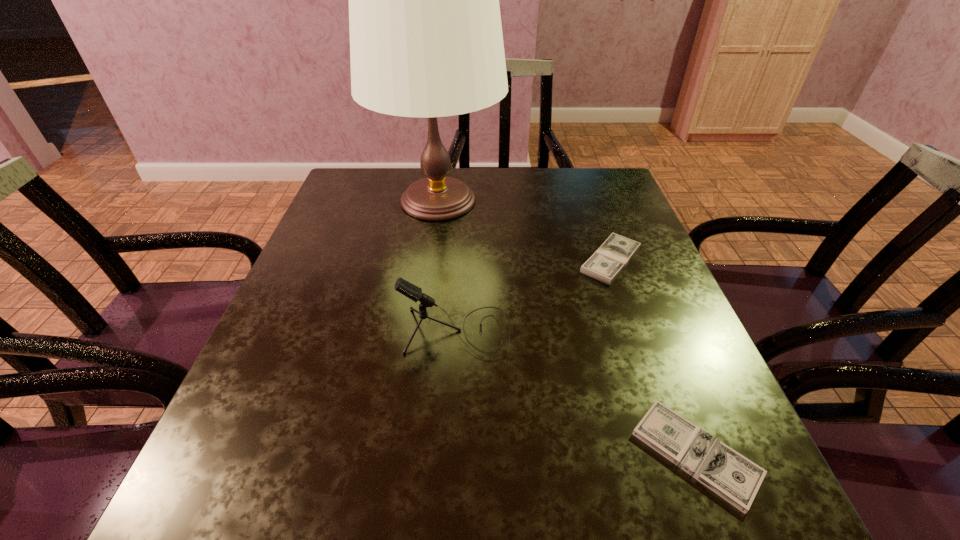
Identify the location of vacant region at the far left corner of the desktop. This screenshot has width=960, height=540. (334, 199).

Image resolution: width=960 pixels, height=540 pixels. What are the coordinates of `free location at the near left corner of the desktop` in the screenshot? It's located at (194, 484).

Find the location of a particular element. Image resolution: width=960 pixels, height=540 pixels. free space at the far right corner of the desktop is located at coordinates (584, 208).

In the image, there is a desktop. At what (x,y) coordinates should I click in order to perform the action: click on vacant space at the near right corner. Please return your answer as a coordinate pair (x, y). The width and height of the screenshot is (960, 540). Looking at the image, I should click on (718, 506).

You are a GUI agent. You are given a task and a screenshot of the screen. Output one action in this format:
    pyautogui.click(x=<x>, y=<y>)
    Task: Click on the free space between the lamp and the microphone
    The height and width of the screenshot is (540, 960).
    Given the screenshot: What is the action you would take?
    pyautogui.click(x=447, y=267)

Find the location of `free area in between the nearer dollar and the lamp`. free area in between the nearer dollar and the lamp is located at coordinates (567, 327).

Locate an element on the screen. vacant point located between the lamp and the microphone is located at coordinates pyautogui.click(x=447, y=267).

Locate an element on the screen. vacant area that lies between the shorter dollar and the second nearest object is located at coordinates (576, 393).

Find the location of a particular element. This screenshot has width=960, height=540. empty space between the lamp and the second nearest object is located at coordinates (447, 267).

This screenshot has height=540, width=960. I want to click on vacant region between the third shortest object and the nearest object, so click(x=576, y=393).